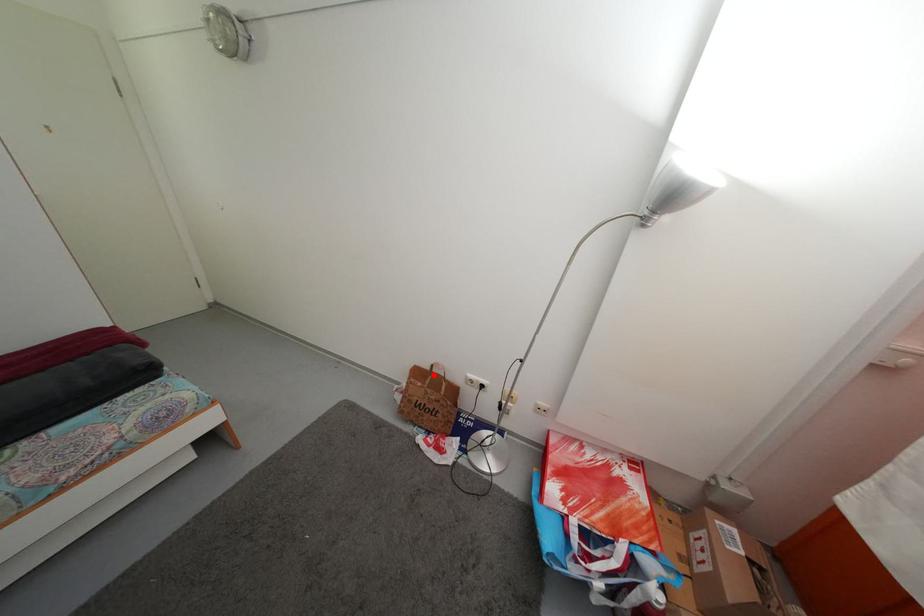
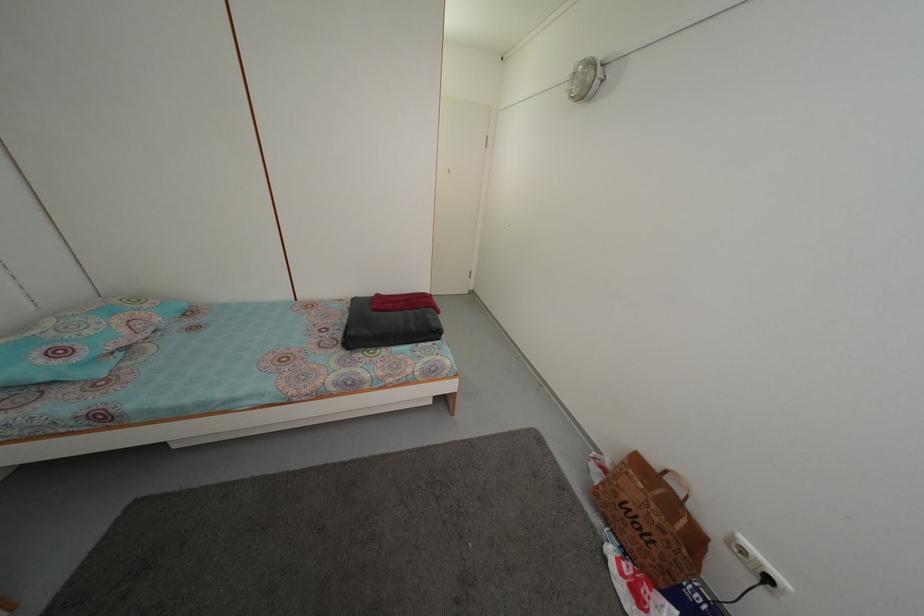
Question: I am providing you with two images of the same scene from different viewpoints. Image1 has a red point marked. In image2, the corresponding 3D location appears at what relative position? Reply with the corresponding letter.

Choices:
 (A) Closer
 (B) Farther

Answer: (A)